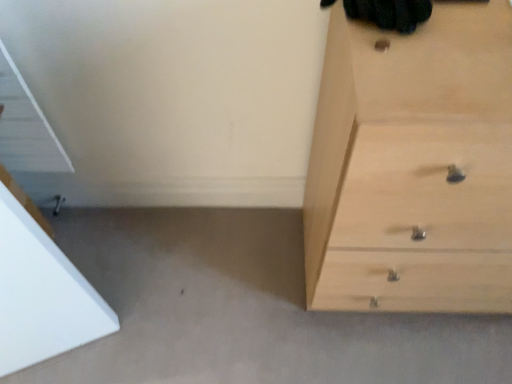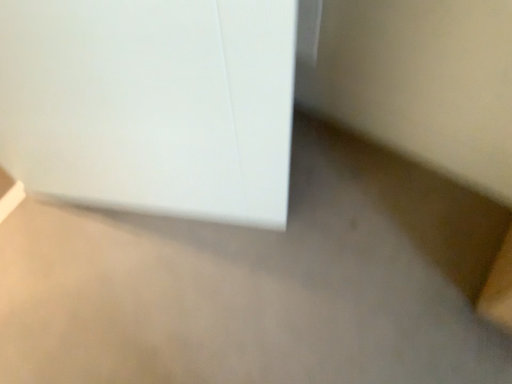
Question: Which way did the camera rotate in the video?

Choices:
 (A) rotated left
 (B) rotated right

Answer: (A)